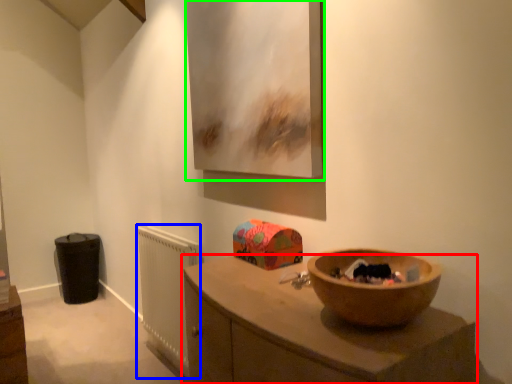
Question: Which object is positioned farthest from countertop (highlighted by a red box)? Select from radiator (highlighted by a blue box) and picture frame (highlighted by a green box).

Choices:
 (A) radiator
 (B) picture frame

Answer: (A)